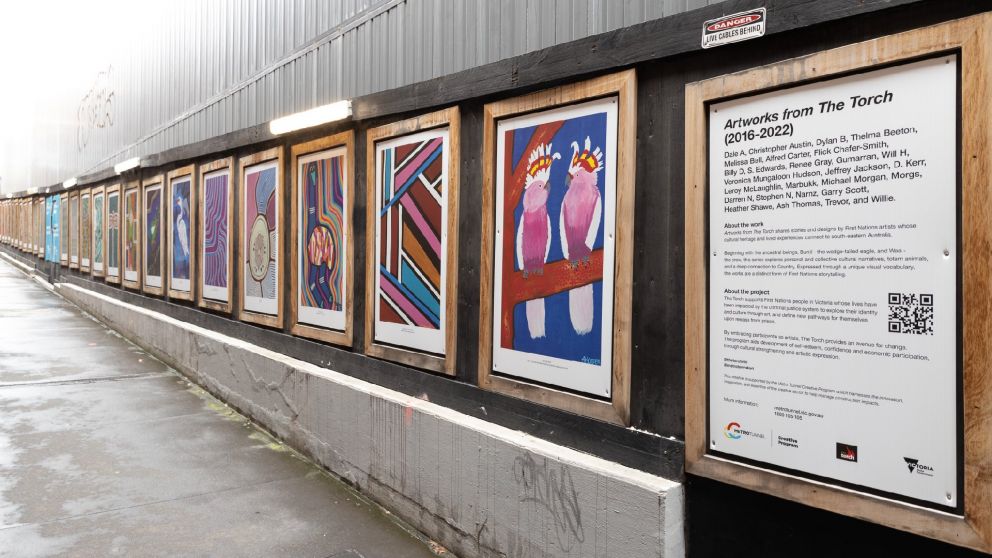
Where is `third nearest artwork`? The image size is (992, 558). third nearest artwork is located at coordinates (328, 240).